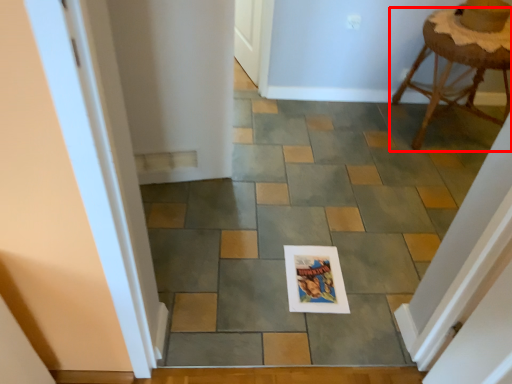
Question: From the image's perspective, where is stool (annotated by the red box) located relative to path?

Choices:
 (A) above
 (B) below

Answer: (A)